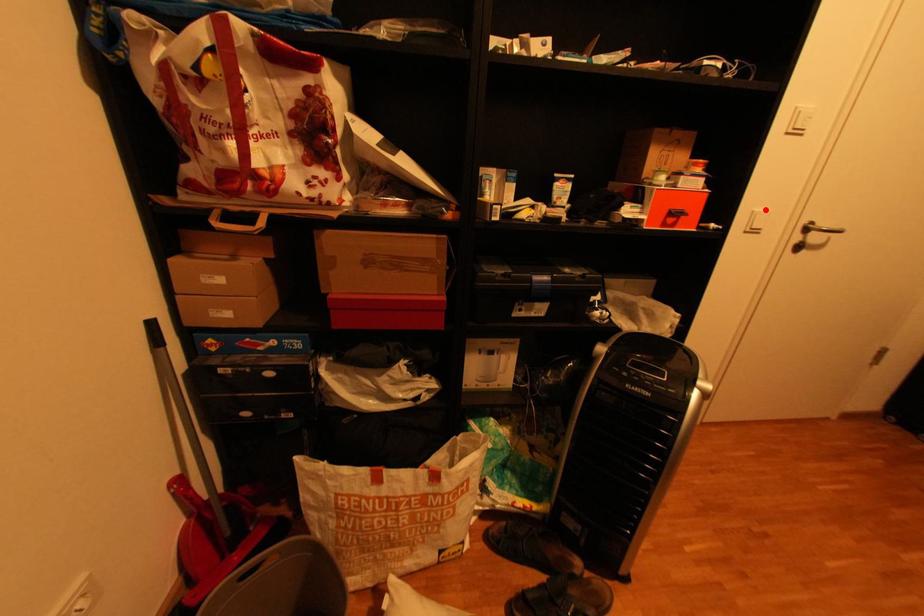
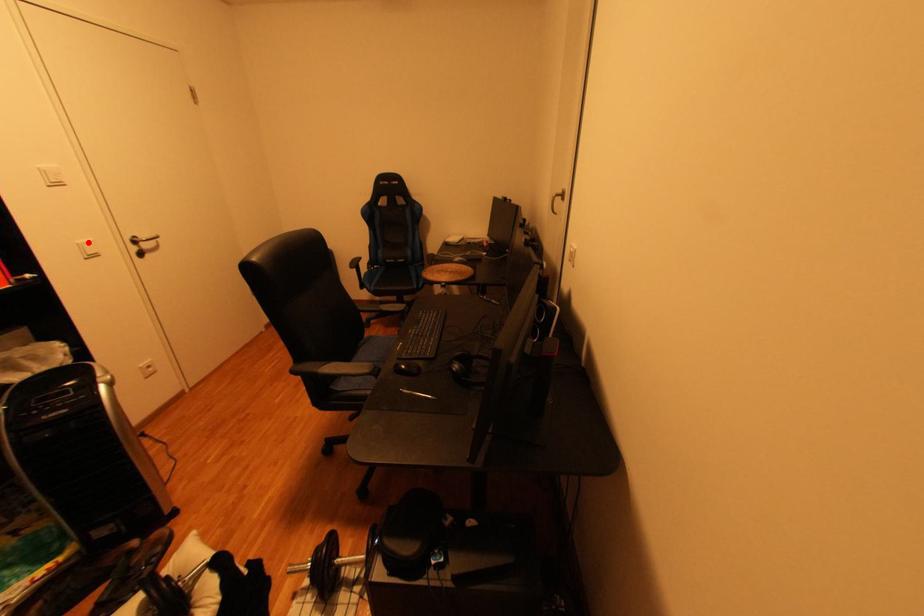
I am providing you with two images of the same scene from different viewpoints. A red point is marked on the first image and another point is marked on the second image. Is the marked point in image1 the same physical position as the marked point in image2?

Yes